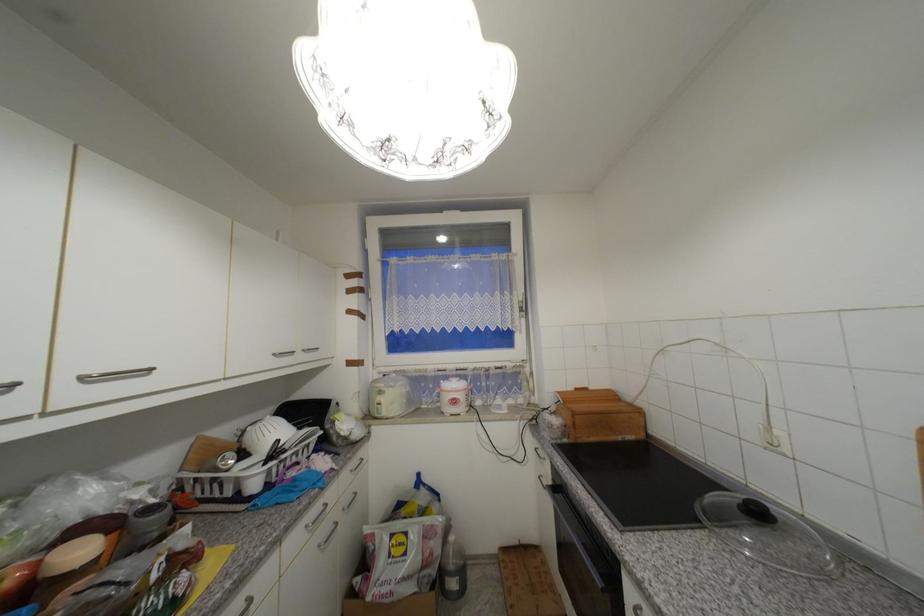
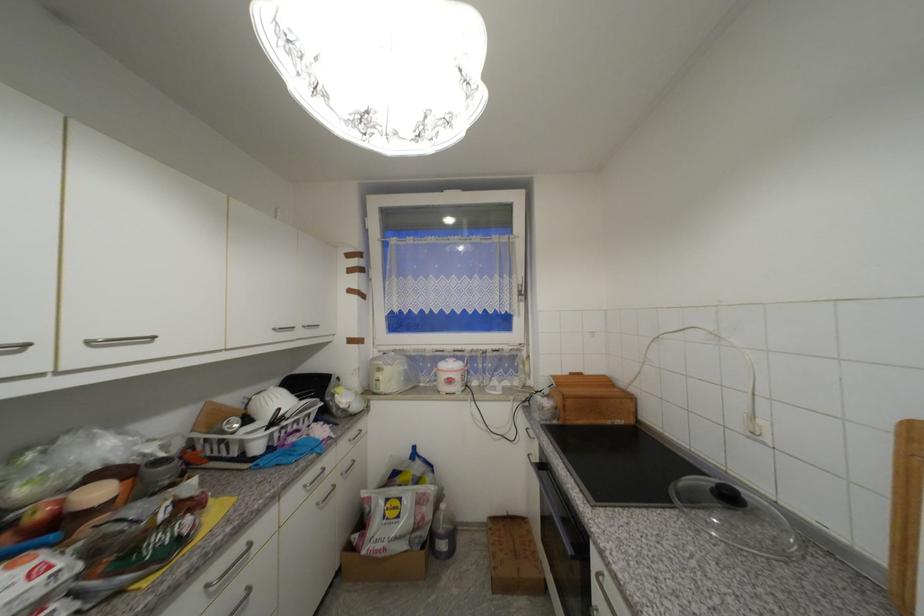
The point at (459, 403) is marked in the first image. Where is the corresponding point in the second image?

(456, 382)